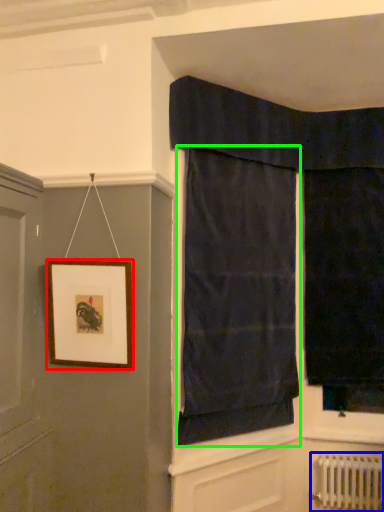
Question: Which object is positioned farthest from picture frame (highlighted by a red box)? Select from radiator (highlighted by a blue box) and curtain (highlighted by a green box).

Choices:
 (A) radiator
 (B) curtain

Answer: (A)